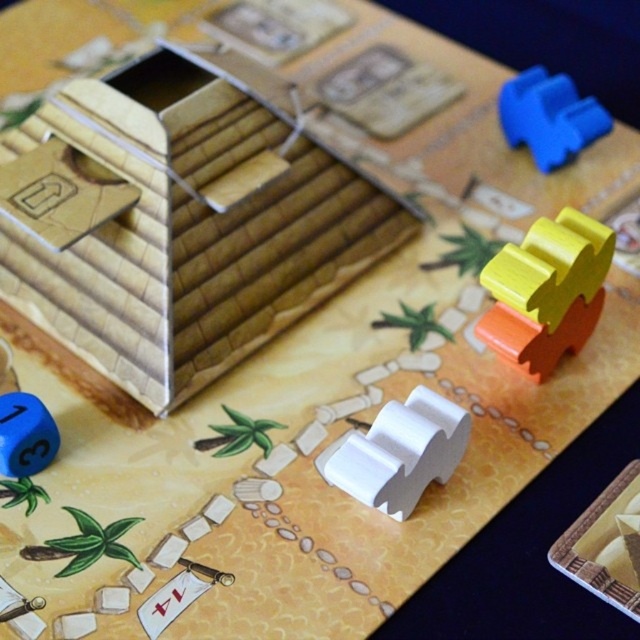
Question: Which point is closer to the camera?

Choices:
 (A) (36, 458)
 (B) (378, 493)

Answer: (B)

Question: Is wooden pyramid at center further to camera compared to white plastic staircase at center?

Choices:
 (A) no
 (B) yes

Answer: (B)

Question: Considering the real-world distances, which object is farthest from the yellow matte wooden piece at upper right?

Choices:
 (A) blue matte die at lower left
 (B) wooden pyramid at center

Answer: (A)

Question: Does yellow matte wooden piece at upper right come in front of blue rubber block at upper right?

Choices:
 (A) yes
 (B) no

Answer: (A)

Question: Does yellow matte wooden piece at upper right have a lesser width compared to blue rubber block at upper right?

Choices:
 (A) no
 (B) yes

Answer: (A)

Question: Estimate the real-world distances between objects in this image. Which object is farther from the white plastic staircase at center?

Choices:
 (A) wooden pyramid at center
 (B) blue matte die at lower left

Answer: (B)